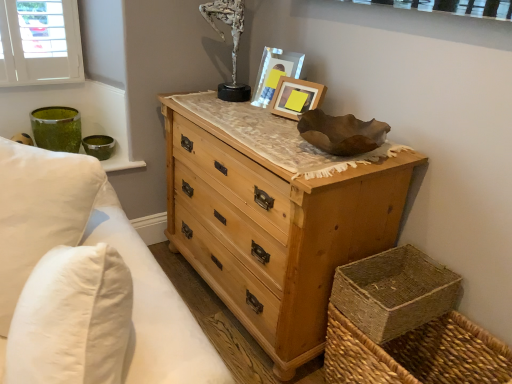
Question: Is matte wooden picture frame at upper center, the 1th picture frame when ordered from back to front, surrounded by white cotton pillows at left?

Choices:
 (A) yes
 (B) no

Answer: (B)

Question: From the image's perspective, would you say white cotton pillows at left is positioned over matte wooden picture frame at upper center, the 2th picture frame positioned from the front?

Choices:
 (A) yes
 (B) no

Answer: (B)

Question: Can you confirm if white cotton pillows at left is smaller than matte wooden picture frame at upper center, the 1th picture frame when ordered from back to front?

Choices:
 (A) no
 (B) yes

Answer: (A)

Question: Considering the relative sizes of white cotton pillows at left and matte wooden picture frame at upper center, the 1th picture frame when ordered from back to front, in the image provided, is white cotton pillows at left wider than matte wooden picture frame at upper center, the 1th picture frame when ordered from back to front,?

Choices:
 (A) no
 (B) yes

Answer: (B)

Question: Can you confirm if white cotton pillows at left is shorter than matte wooden picture frame at upper center, the 1th picture frame when ordered from back to front?

Choices:
 (A) no
 (B) yes

Answer: (A)

Question: From a real-world perspective, is woven natural basket at lower right positioned above or below white cotton pillows at left?

Choices:
 (A) above
 (B) below

Answer: (B)

Question: In the image, is woven natural basket at lower right on the left side or the right side of white cotton pillows at left?

Choices:
 (A) left
 (B) right

Answer: (B)

Question: Is woven natural basket at lower right in front of or behind white cotton pillows at left in the image?

Choices:
 (A) behind
 (B) front

Answer: (A)

Question: Looking at their shapes, would you say woven natural basket at lower right is wider or thinner than white cotton pillows at left?

Choices:
 (A) wide
 (B) thin

Answer: (A)

Question: From the image's perspective, is white cotton pillows at left above or below matte wooden picture frame at upper center, the 1th picture frame when ordered from back to front?

Choices:
 (A) below
 (B) above

Answer: (A)

Question: Is white cotton pillows at left taller or shorter than matte wooden picture frame at upper center, the 1th picture frame when ordered from back to front?

Choices:
 (A) tall
 (B) short

Answer: (A)

Question: Considering their positions, is white cotton pillows at left located in front of or behind matte wooden picture frame at upper center, the 2th picture frame positioned from the front?

Choices:
 (A) front
 (B) behind

Answer: (A)

Question: Is white cotton pillows at left inside the boundaries of matte wooden picture frame at upper center, the 1th picture frame when ordered from back to front, or outside?

Choices:
 (A) inside
 (B) outside

Answer: (B)

Question: From their relative heights in the image, would you say wooden picture frame at upper center, acting as the first picture frame starting from the front, is taller or shorter than woven natural basket at lower right?

Choices:
 (A) tall
 (B) short

Answer: (A)

Question: Is wooden picture frame at upper center, which is counted as the 2th picture frame, starting from the back, spatially inside woven natural basket at lower right, or outside of it?

Choices:
 (A) inside
 (B) outside

Answer: (B)